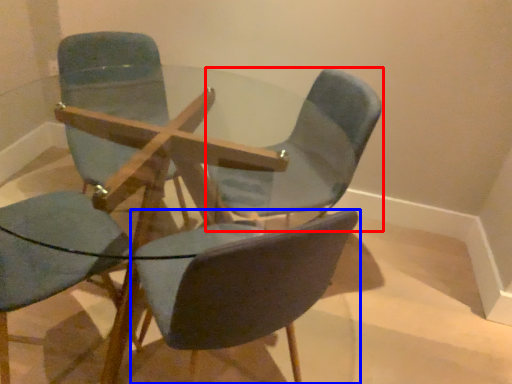
Question: Among these objects, which one is farthest to the camera, chair (highlighted by a red box) or chair (highlighted by a blue box)?

Choices:
 (A) chair
 (B) chair

Answer: (A)